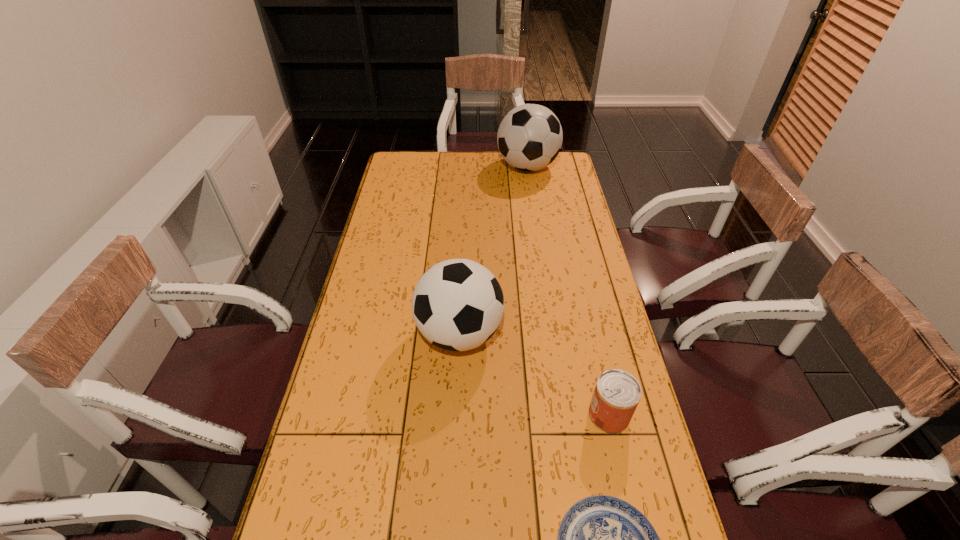
Identify the location of soccer ball present at the right edge. The height and width of the screenshot is (540, 960). (529, 138).

Find the location of `can at the right edge`. can at the right edge is located at coordinates (617, 393).

This screenshot has height=540, width=960. In order to click on object located in the far right corner section of the desktop in this screenshot , I will do `click(529, 138)`.

In the image, there is a desktop. Identify the location of free space at the far edge. (441, 157).

The height and width of the screenshot is (540, 960). I want to click on free location at the left edge of the desktop, so click(x=383, y=196).

The width and height of the screenshot is (960, 540). I want to click on vacant region at the right edge of the desktop, so click(x=563, y=213).

In the image, there is a desktop. Identify the location of vacant area at the far right corner. Image resolution: width=960 pixels, height=540 pixels. (558, 163).

The width and height of the screenshot is (960, 540). Find the location of `vacant region between the farther soccer ball and the leftmost object`. vacant region between the farther soccer ball and the leftmost object is located at coordinates (493, 251).

This screenshot has width=960, height=540. In order to click on vacant region between the nearer soccer ball and the second shortest object in this screenshot , I will do `click(534, 374)`.

Where is `vacant area that lies between the third nearest object and the farther soccer ball`? This screenshot has height=540, width=960. vacant area that lies between the third nearest object and the farther soccer ball is located at coordinates (493, 251).